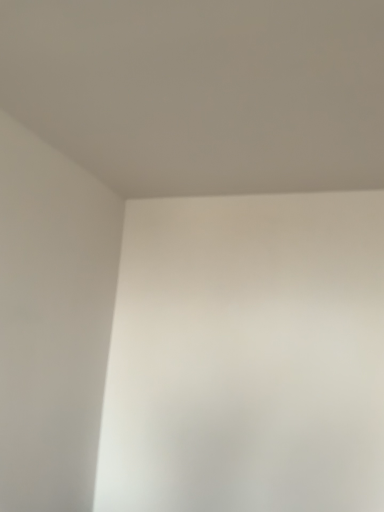
Image resolution: width=384 pixels, height=512 pixels. Identify the location of white matte ceiling at upper left. (202, 91).

Describe the element at coordinates (202, 91) in the screenshot. I see `white matte ceiling at upper left` at that location.

Find the location of a particular element. This screenshot has width=384, height=512. white matte ceiling at upper left is located at coordinates (202, 91).